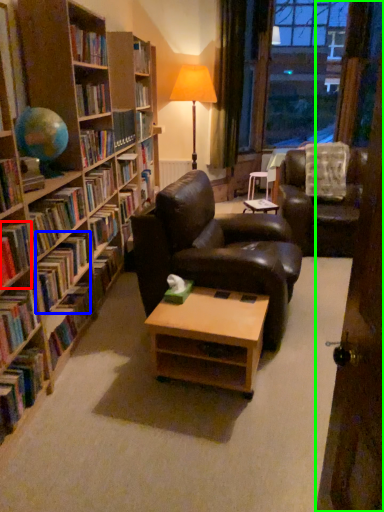
Question: Based on their relative distances, which object is nearer to book (highlighted by a red box)? Choose from book (highlighted by a blue box) and door (highlighted by a green box).

Choices:
 (A) book
 (B) door

Answer: (A)